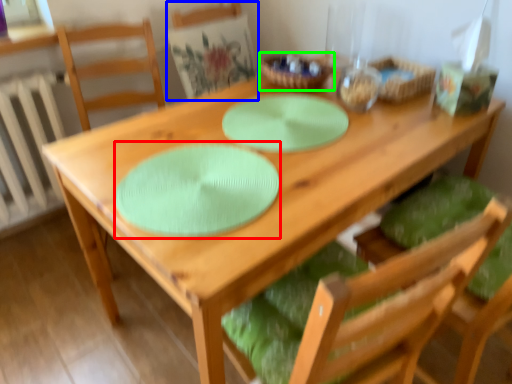
Question: Estimate the real-world distances between objects in this image. Which object is closer to paper plate (highlighted by a red box), chair (highlighted by a blue box) or tableware (highlighted by a green box)?

Choices:
 (A) chair
 (B) tableware

Answer: (B)